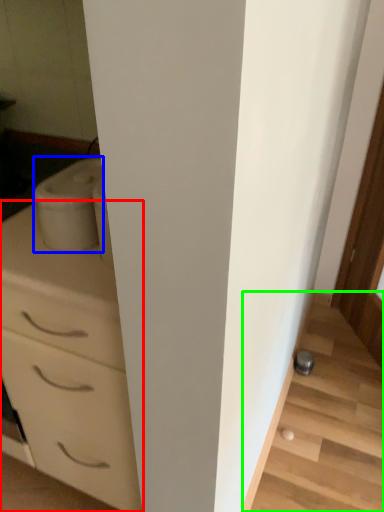
Question: Which is farther away from chest of drawers (highlighted by a red box)? appliance (highlighted by a blue box) or stairwell (highlighted by a green box)?

Choices:
 (A) appliance
 (B) stairwell

Answer: (B)